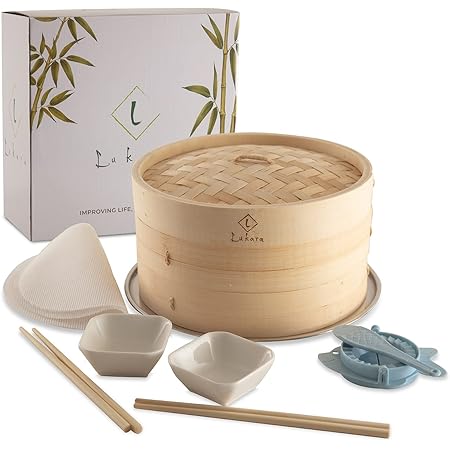
At what (x,y) coordinates should I click in order to perform the action: click on bowls. Please return your answer as a coordinate pair (x, y). Image resolution: width=450 pixels, height=450 pixels. Looking at the image, I should click on (127, 341), (221, 366).